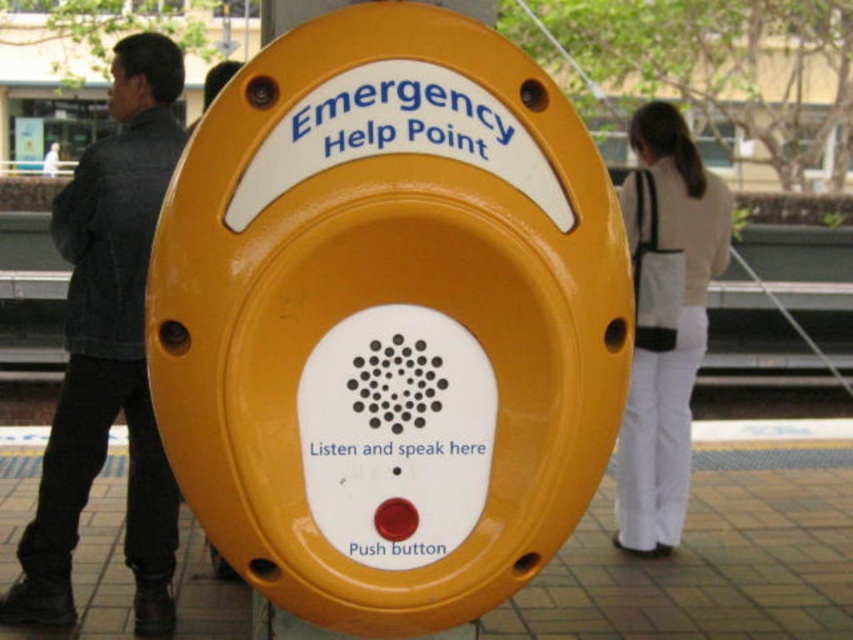
Question: Which point is closer to the camera taking this photo?

Choices:
 (A) (635, 465)
 (B) (149, 218)

Answer: (B)

Question: Is dark gray denim jacket at left to the left of white fabric bag at right from the viewer's perspective?

Choices:
 (A) yes
 (B) no

Answer: (A)

Question: Can you confirm if dark gray denim jacket at left is thinner than white fabric bag at right?

Choices:
 (A) no
 (B) yes

Answer: (A)

Question: Can you confirm if dark gray denim jacket at left is bigger than white fabric bag at right?

Choices:
 (A) no
 (B) yes

Answer: (B)

Question: Which point is farther from the camera taking this photo?

Choices:
 (A) (699, 243)
 (B) (123, 314)

Answer: (A)

Question: Which point is closer to the camera?

Choices:
 (A) white fabric bag at right
 (B) dark gray denim jacket at left

Answer: (B)